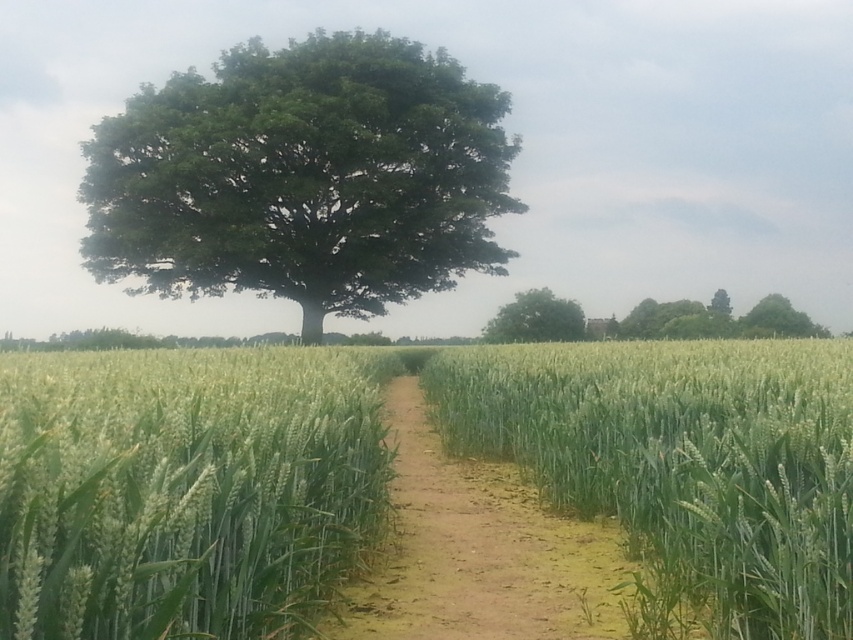
You are standing on the dirt path leading to the tree and want to step onto the green grassy wheat field at center or the green leafy tree at center. Which one is easier to reach?

The green grassy wheat field at center is closer to the viewer than the green leafy tree at center, so it is easier to reach.

From the picture: You are a farmer planning to plant a new crop in the field. The coordinates of the green matte wheat at center are given. If you want to plant the new crop in an area that is not overlapping with the existing wheat, where should you place it?

Since the green matte wheat at center is located at coordinates point (184, 488), you should plant the new crop in an area outside these coordinates to avoid overlap.

You are a farmer planning to plant a new row of wheat between the green leafy oak tree at center and the green leafy tree at center. Given that the oak tree is wider, which tree should you avoid planting too close to to prevent shading the new wheat row?

You should avoid planting too close to the green leafy oak tree at center because its width is larger than the green leafy tree at center, making it more likely to cast a broader shadow over the new wheat row.